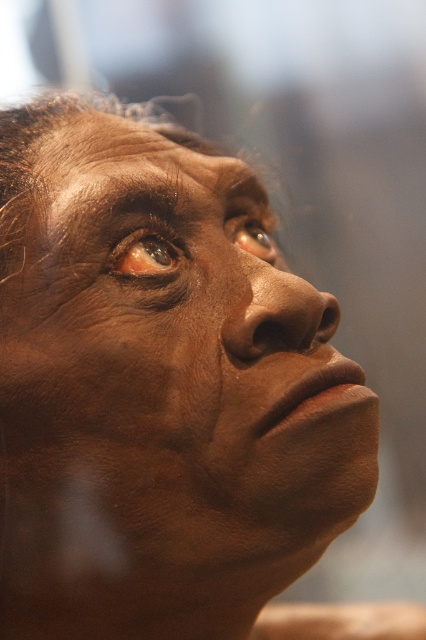
Is matte brown face at center smaller than brown matte eye at upper left?

Incorrect, matte brown face at center is not smaller in size than brown matte eye at upper left.

The width and height of the screenshot is (426, 640). What do you see at coordinates (172, 355) in the screenshot? I see `matte brown face at center` at bounding box center [172, 355].

I want to click on matte brown face at center, so click(172, 355).

The width and height of the screenshot is (426, 640). Identify the location of matte brown face at center. (172, 355).

Which of these two, matte brown face at center or brown matte eye at upper center, stands taller?

With more height is matte brown face at center.

Which is in front, point (238, 172) or point (275, 248)?

Point (238, 172) is in front.

In order to click on matte brown face at center in this screenshot , I will do `click(172, 355)`.

Does point (112, 272) lie behind point (241, 243)?

No, (112, 272) is in front of (241, 243).

Is brown matte eye at upper left above brown matte eye at upper center?

No, brown matte eye at upper left is not above brown matte eye at upper center.

Who is more distant from viewer, (169, 250) or (252, 241)?

The point (252, 241) is more distant.

The width and height of the screenshot is (426, 640). In order to click on brown matte eye at upper left in this screenshot , I will do `click(144, 253)`.